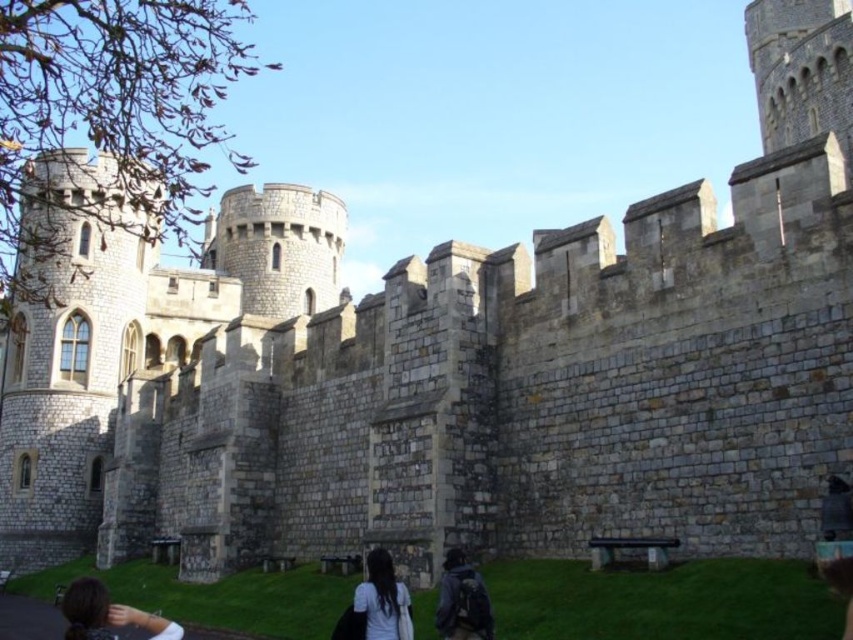
You are standing in front of the castle and see the dark brown hair at lower left and the dark gray backpack at lower center. Which object is positioned more to the left side?

The dark brown hair at lower left is positioned to the left of the dark gray backpack at lower center, so the dark brown hair at lower left is more to the left side.

Looking at this image, based on the scene description of the historic stone castle, can you determine if the dark brown hair at lower left is wider than the dark gray backpack at lower center?

The dark brown hair at lower left might be wider than dark gray backpack at lower center according to the description.

You are standing at the castle entrance and see the two people walking away from you. There is a dark brown hair at lower left near point (107,614). Which direction should you move to get closer to the dark brown hair at lower left?

To get closer to the dark brown hair at lower left near point (107,614), you should move towards the lower left direction from your current position at the castle entrance.